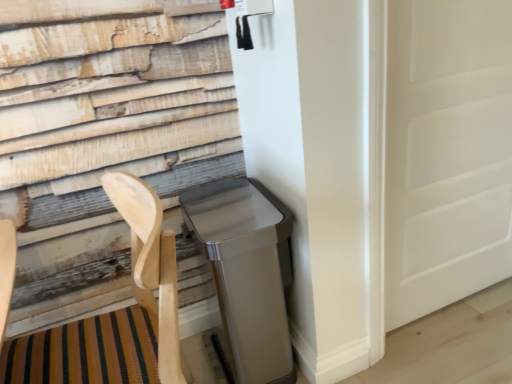
Question: Looking at the image, does satin silver trash can at lower right seem bigger or smaller compared to white matte door at right?

Choices:
 (A) big
 (B) small

Answer: (A)

Question: From their relative heights in the image, would you say satin silver trash can at lower right is taller or shorter than white matte door at right?

Choices:
 (A) short
 (B) tall

Answer: (A)

Question: Which object is positioned closest to the white matte door at right?

Choices:
 (A) satin silver trash can at lower right
 (B) natural wood folding chair at lower left

Answer: (A)

Question: Based on their relative distances, which object is nearer to the satin silver trash can at lower right?

Choices:
 (A) natural wood folding chair at lower left
 (B) white matte door at right

Answer: (A)